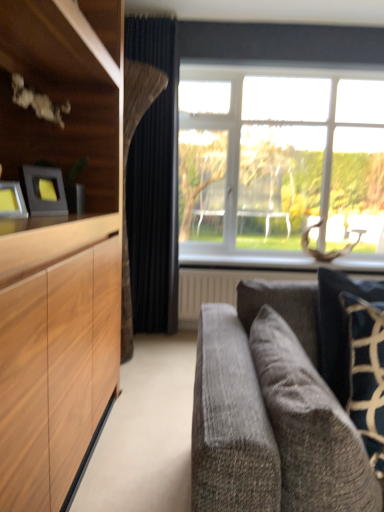
Question: Is metallic silver picture frame at left, which is the 2th picture frame in back-to-front order, bigger than velvet gray couch at lower right?

Choices:
 (A) no
 (B) yes

Answer: (A)

Question: Is metallic silver picture frame at left, positioned as the first picture frame in front-to-back order, far away from velvet gray couch at lower right?

Choices:
 (A) no
 (B) yes

Answer: (A)

Question: Considering the relative sizes of metallic silver picture frame at left, which is the 2th picture frame in back-to-front order, and velvet gray couch at lower right in the image provided, is metallic silver picture frame at left, which is the 2th picture frame in back-to-front order, taller than velvet gray couch at lower right?

Choices:
 (A) yes
 (B) no

Answer: (B)

Question: Is the position of metallic silver picture frame at left, positioned as the first picture frame in front-to-back order, more distant than that of velvet gray couch at lower right?

Choices:
 (A) yes
 (B) no

Answer: (A)

Question: Is velvet gray couch at lower right surrounded by metallic silver picture frame at left, positioned as the first picture frame in front-to-back order?

Choices:
 (A) no
 (B) yes

Answer: (A)

Question: Can you confirm if metallic silver picture frame at left, positioned as the first picture frame in front-to-back order, is smaller than velvet gray couch at lower right?

Choices:
 (A) no
 (B) yes

Answer: (B)

Question: Can you see velvet gray couch at lower right touching velvet dark blue pillow at right?

Choices:
 (A) no
 (B) yes

Answer: (A)

Question: Is velvet gray couch at lower right taller than velvet dark blue pillow at right?

Choices:
 (A) no
 (B) yes

Answer: (A)

Question: Is velvet gray couch at lower right to the left of velvet dark blue pillow at right from the viewer's perspective?

Choices:
 (A) no
 (B) yes

Answer: (B)

Question: Is velvet gray couch at lower right bigger than velvet dark blue pillow at right?

Choices:
 (A) yes
 (B) no

Answer: (A)

Question: Does velvet gray couch at lower right lie in front of velvet dark blue pillow at right?

Choices:
 (A) yes
 (B) no

Answer: (A)

Question: Can you confirm if velvet gray couch at lower right is smaller than velvet dark blue pillow at right?

Choices:
 (A) yes
 (B) no

Answer: (B)

Question: Is velvet gray couch at lower right turned away from white textured radiator at lower center?

Choices:
 (A) no
 (B) yes

Answer: (A)